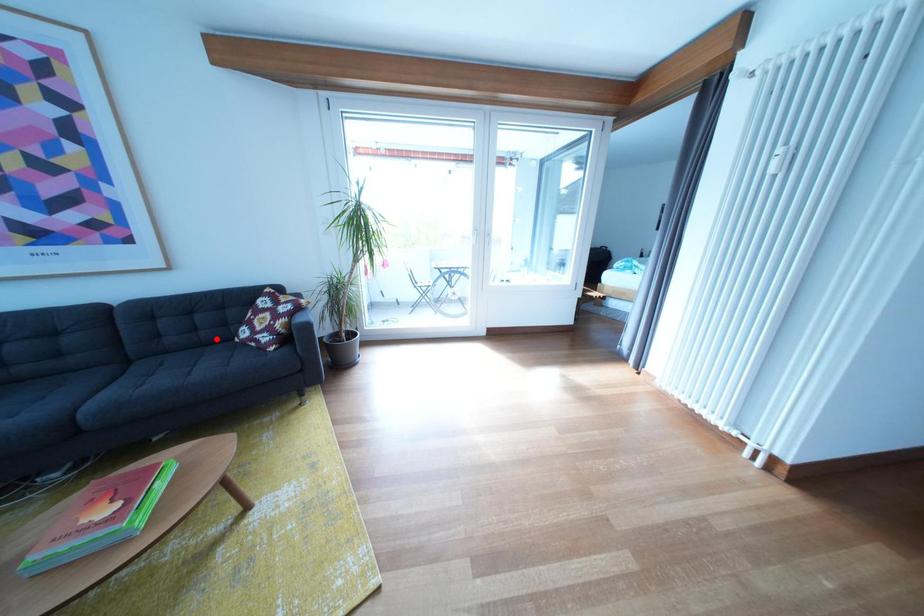
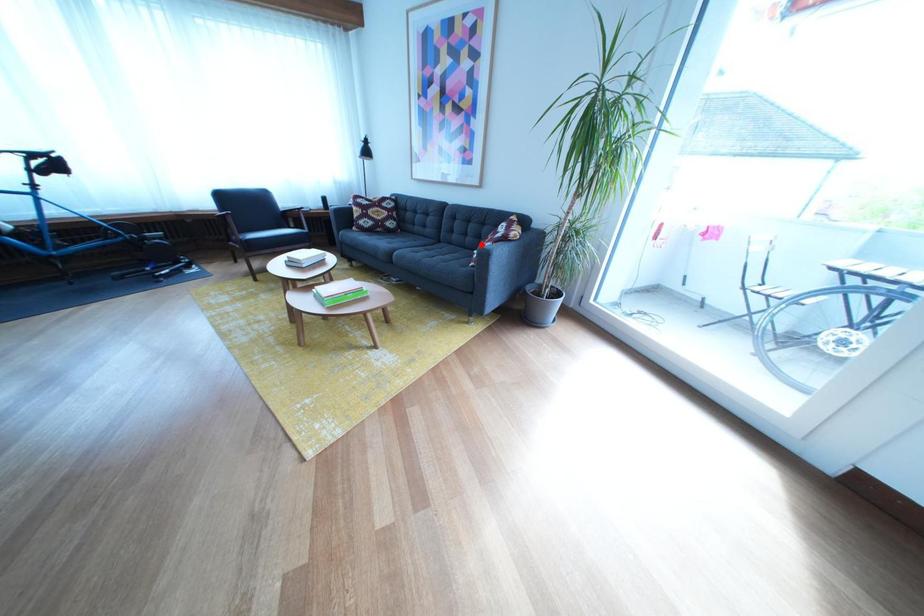
I am providing you with two images of the same scene from different viewpoints. A red point is marked on the first image and another point is marked on the second image. Are the points marked in image1 and image2 representing the same 3D position?

Yes